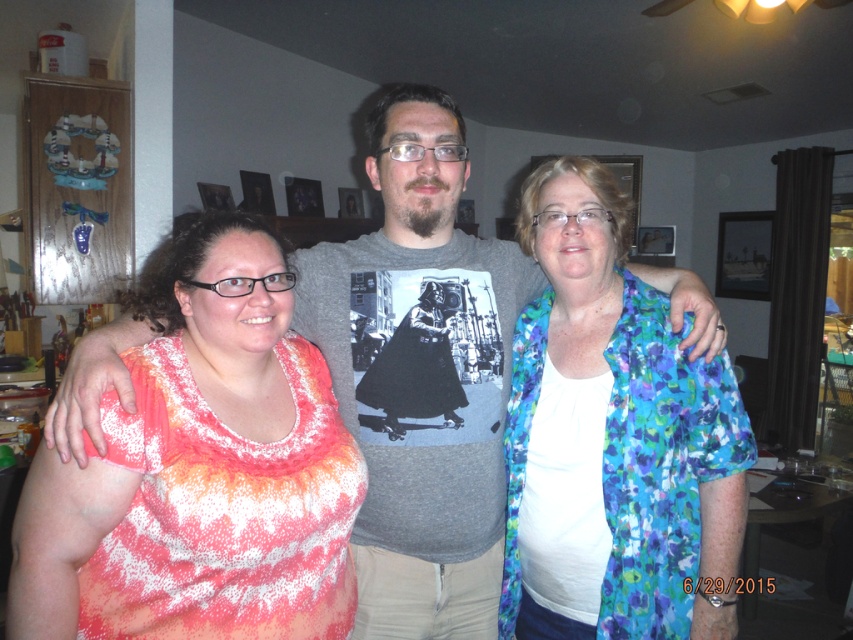
You are standing in the living room and want to reach both the point at coordinates (578, 220) and the point at coordinates (500, 445). Which point should you aim for first to minimize the distance you walk?

You should aim for point (578, 220) first because it is closer to you than point (500, 445).